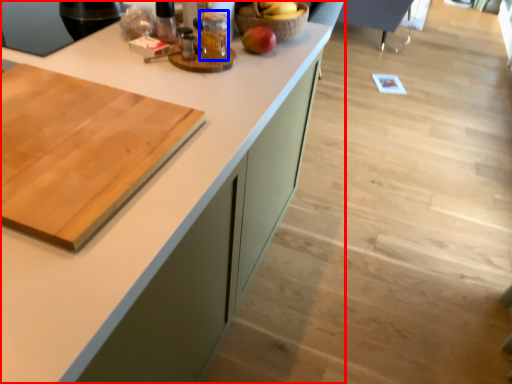
Question: Which object is further to the camera taking this photo, countertop (highlighted by a red box) or beverage (highlighted by a blue box)?

Choices:
 (A) countertop
 (B) beverage

Answer: (B)